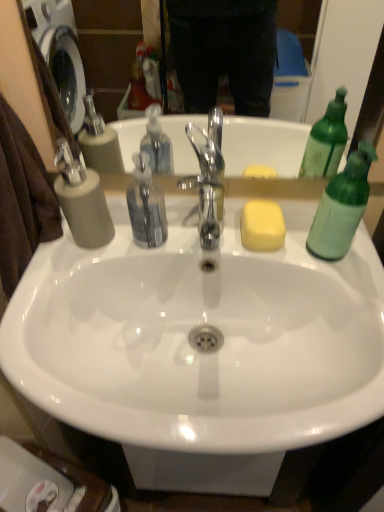
Identify the location of vacant space in front of green translucent bottle at right. coord(349,304).